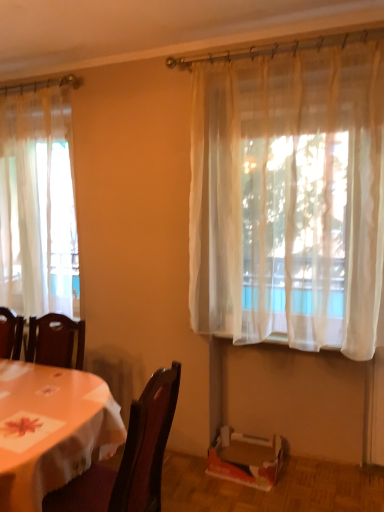
Locate an element on the screen. The image size is (384, 512). vacant space in front of cardboard box at lower right is located at coordinates (254, 499).